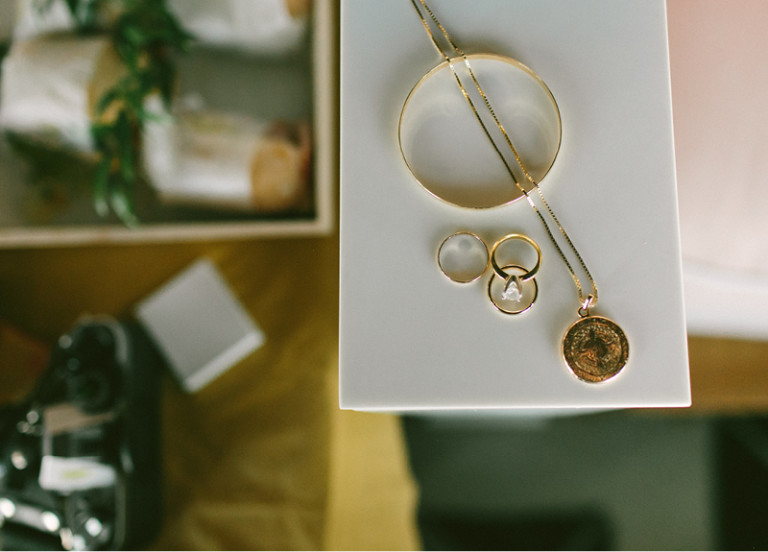
You are a GUI agent. You are given a task and a screenshot of the screen. Output one action in this format:
    pyautogui.click(x=<x>, y=<y>)
    Task: Click on the white counter
    Image resolution: width=768 pixels, height=552 pixels.
    Given the screenshot: What is the action you would take?
    591,176